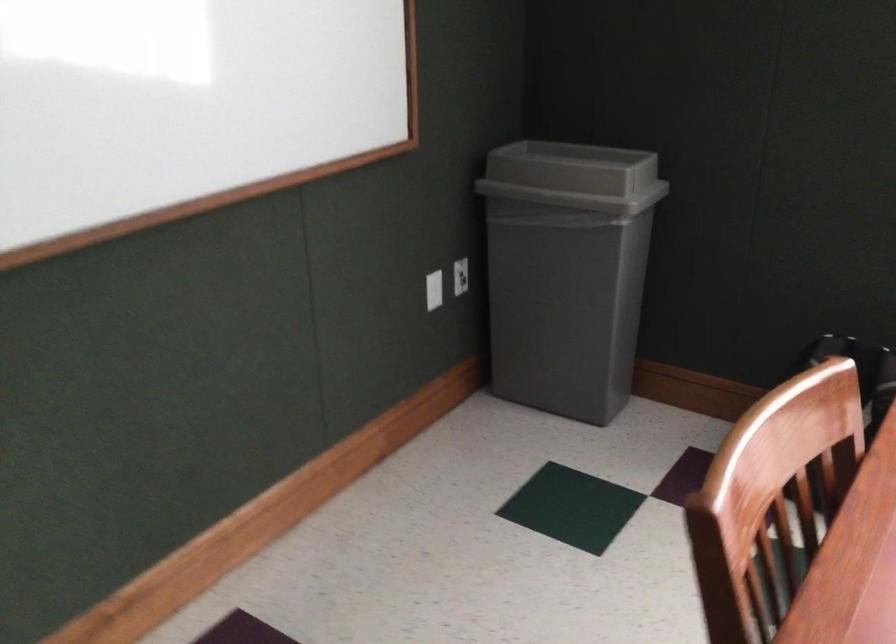
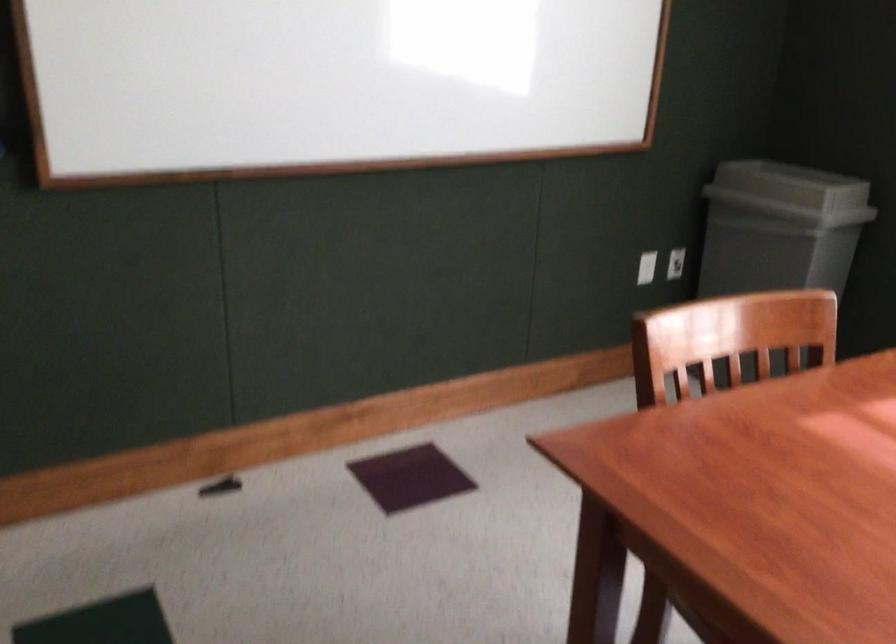
Question: The camera is either moving clockwise (left) or counter-clockwise (right) around the object. The first image is from the beginning of the video and the second image is from the end. Is the camera moving left or right when shooting the video?

Choices:
 (A) Left
 (B) Right

Answer: (B)